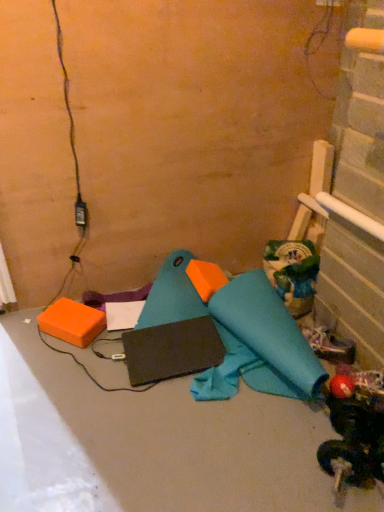
I want to click on free space in front of orange foam block at lower left, so click(x=69, y=364).